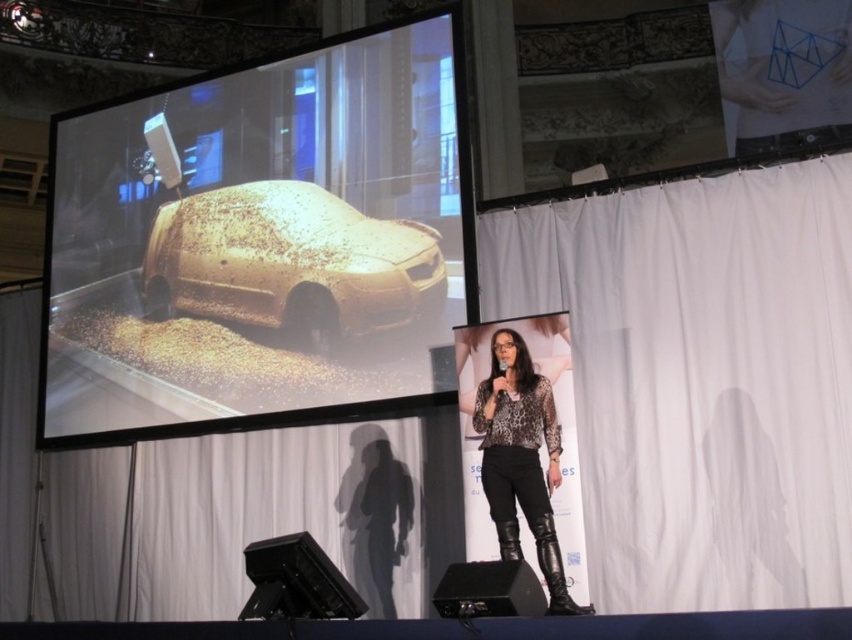
Looking at this image, is gold glitter car at upper left to the right of gold textured car at center from the viewer's perspective?

Incorrect, gold glitter car at upper left is not on the right side of gold textured car at center.

Between gold glitter car at upper left and gold textured car at center, which one appears on the right side from the viewer's perspective?

gold textured car at center

Is point (346, 340) positioned after point (383, 314)?

That is True.

Locate an element on the screen. The image size is (852, 640). gold glitter car at upper left is located at coordinates (260, 241).

Can you confirm if gold glitter car at upper left is bigger than white matte curtain at center?

Correct, gold glitter car at upper left is larger in size than white matte curtain at center.

Based on the photo, between gold glitter car at upper left and white matte curtain at center, which one appears on the right side from the viewer's perspective?

From the viewer's perspective, white matte curtain at center appears more on the right side.

Which is behind, point (206, 172) or point (735, 564)?

Positioned behind is point (206, 172).

Locate an element on the screen. This screenshot has height=640, width=852. gold glitter car at upper left is located at coordinates (260, 241).

I want to click on white matte curtain at upper center, so click(281, 509).

Who is positioned more to the left, white matte curtain at upper center or gold textured car at center?

white matte curtain at upper center is more to the left.

Which is behind, point (350, 461) or point (407, 237)?

Point (407, 237)

Find the location of a particular element. The width and height of the screenshot is (852, 640). white matte curtain at upper center is located at coordinates (281, 509).